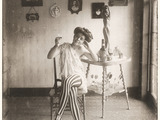
The width and height of the screenshot is (160, 120). Identify the location of table. (115, 57).